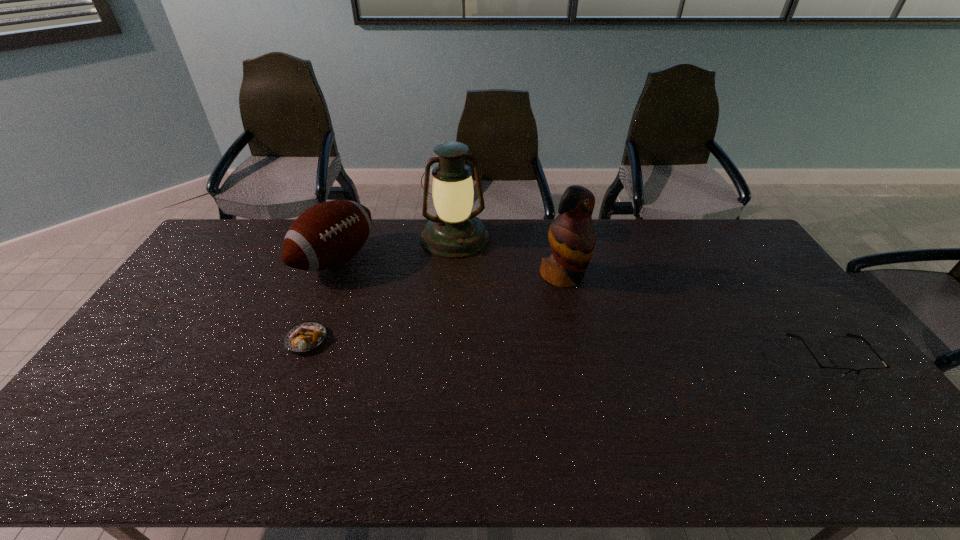
This screenshot has height=540, width=960. I want to click on vacant space at the right edge of the desktop, so pyautogui.click(x=814, y=354).

In order to click on free region at the far left corner of the desktop in this screenshot , I will do `click(242, 242)`.

I want to click on vacant region between the third object from right to left and the parrot, so click(509, 256).

Where is `vacant area between the third object from left to right and the second object from right to left`? The width and height of the screenshot is (960, 540). vacant area between the third object from left to right and the second object from right to left is located at coordinates pyautogui.click(x=509, y=256).

Identify the location of empty space between the third tallest object and the pastry. The width and height of the screenshot is (960, 540). click(322, 300).

Find the location of a particular element. free spot between the third object from left to right and the spectacles is located at coordinates (643, 297).

This screenshot has width=960, height=540. I want to click on free space between the rightmost object and the second object from right to left, so click(698, 316).

Where is `vacant space that is in between the lantern and the parrot`? The width and height of the screenshot is (960, 540). vacant space that is in between the lantern and the parrot is located at coordinates (509, 256).

I want to click on vacant space that's between the third object from right to left and the rightmost object, so click(x=643, y=297).

Find the location of a particular element. empty space that is in between the parrot and the spectacles is located at coordinates (698, 316).